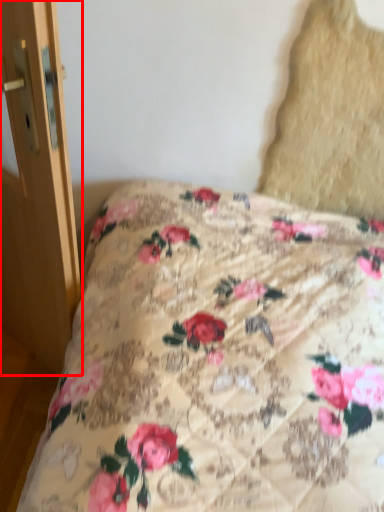
Question: From the image's perspective, where is screen door (annotated by the red box) located in relation to pillow in the image?

Choices:
 (A) above
 (B) below

Answer: (B)